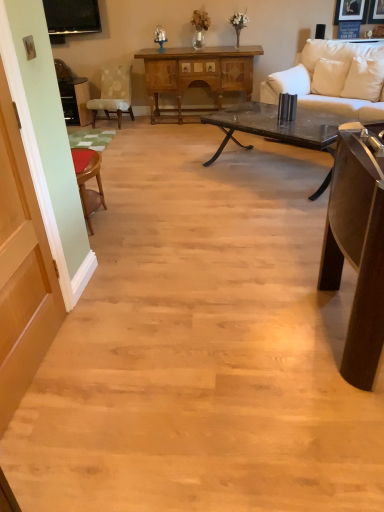
Where is `empty space that is in between dark brown wood table at right, which is the 1th table from front to back, and transparent glass door at left`? The height and width of the screenshot is (512, 384). empty space that is in between dark brown wood table at right, which is the 1th table from front to back, and transparent glass door at left is located at coordinates (192, 350).